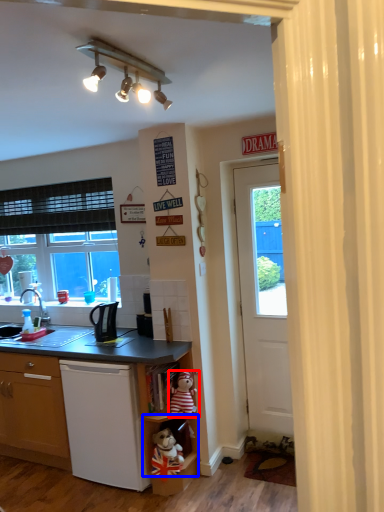
Question: Which of the following is the farthest to the observer, teddy bear (highlighted by a red box) or shelf (highlighted by a blue box)?

Choices:
 (A) teddy bear
 (B) shelf

Answer: (A)